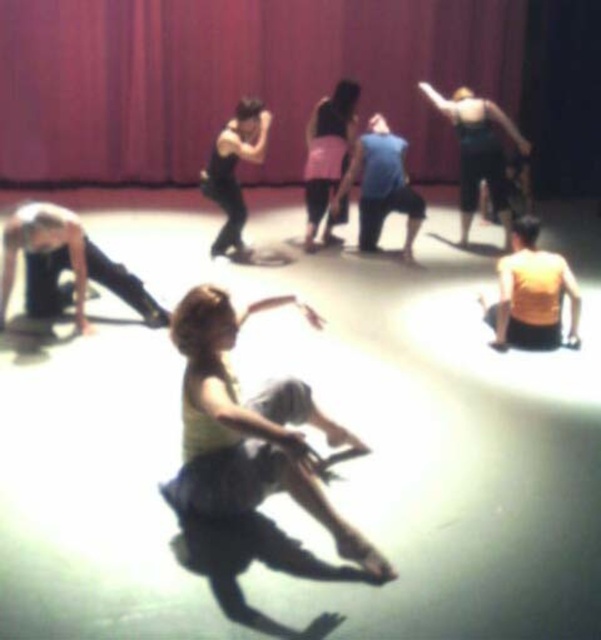
This screenshot has width=601, height=640. Describe the element at coordinates (532, 294) in the screenshot. I see `yellow matte tank top at lower right` at that location.

Between yellow matte tank top at lower right and pink fabric skirt at center, which one appears on the left side from the viewer's perspective?

pink fabric skirt at center is more to the left.

Does point (504, 268) come behind point (323, 108)?

That is False.

Where is `yellow matte tank top at lower right`? The width and height of the screenshot is (601, 640). yellow matte tank top at lower right is located at coordinates (532, 294).

Can you confirm if matte red curtain at upper center is positioned to the left of green fabric dress at upper right?

Indeed, matte red curtain at upper center is positioned on the left side of green fabric dress at upper right.

Which is in front, point (406, 49) or point (486, 166)?

Point (486, 166) is more forward.

The image size is (601, 640). Find the location of `matte red curtain at upper center`. matte red curtain at upper center is located at coordinates (233, 77).

Is green fabric dress at upper right taller than pink fabric skirt at center?

Yes.

Identify the location of green fabric dress at upper right. This screenshot has width=601, height=640. (478, 150).

Does point (471, 122) come behind point (313, 163)?

Yes, it is behind point (313, 163).

You are a GUI agent. You are given a task and a screenshot of the screen. Output one action in this format:
    pyautogui.click(x=<x>, y=<y>)
    Task: Click on the green fabric dress at upper right
    
    Given the screenshot: What is the action you would take?
    pyautogui.click(x=478, y=150)